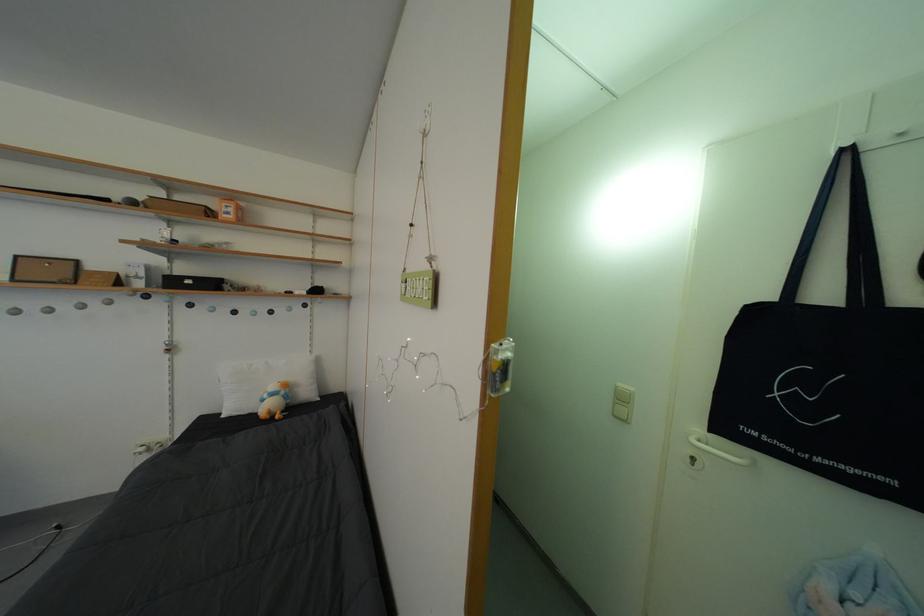
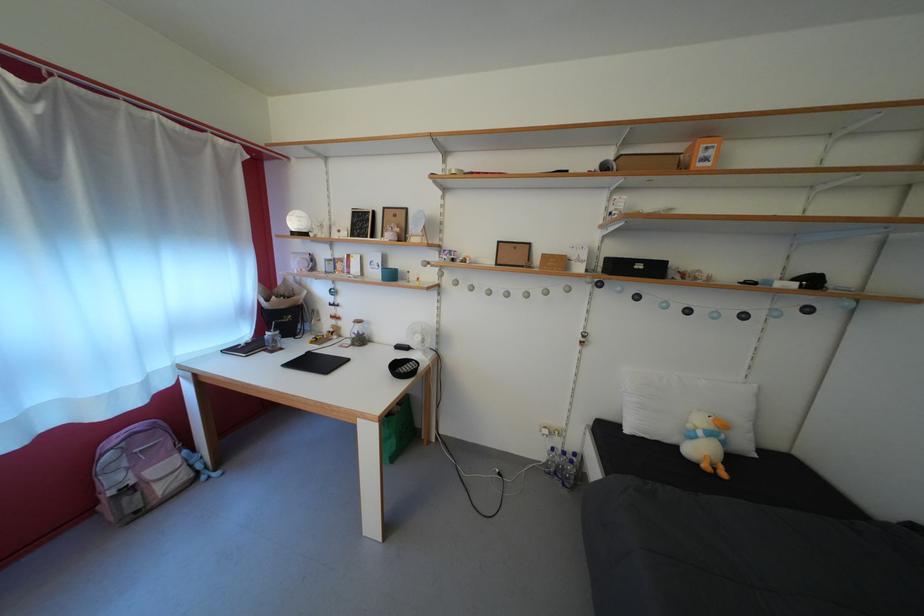
Locate, in the second image, the point that corresponds to point (198, 288) in the first image.

(648, 273)